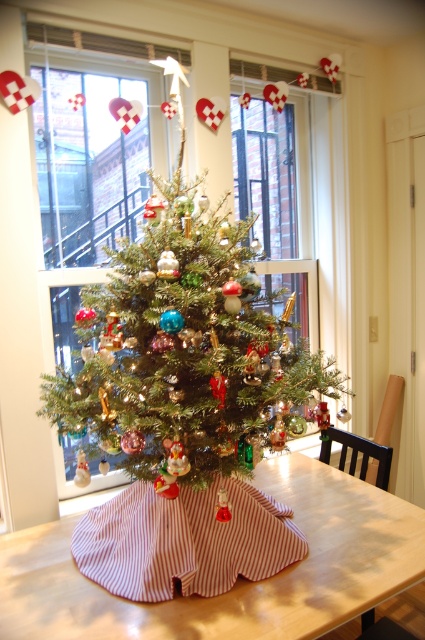
Question: Among these points, which one is farthest from the camera?

Choices:
 (A) (198, 445)
 (B) (48, 588)

Answer: (B)

Question: Does green matte christmas tree at center appear on the right side of wooden table at center?

Choices:
 (A) no
 (B) yes

Answer: (A)

Question: Can you confirm if green matte christmas tree at center is positioned to the left of wooden table at center?

Choices:
 (A) no
 (B) yes

Answer: (B)

Question: Does green matte christmas tree at center have a lesser width compared to wooden table at center?

Choices:
 (A) no
 (B) yes

Answer: (B)

Question: Which point is closer to the camera?

Choices:
 (A) wooden table at center
 (B) green matte christmas tree at center

Answer: (A)